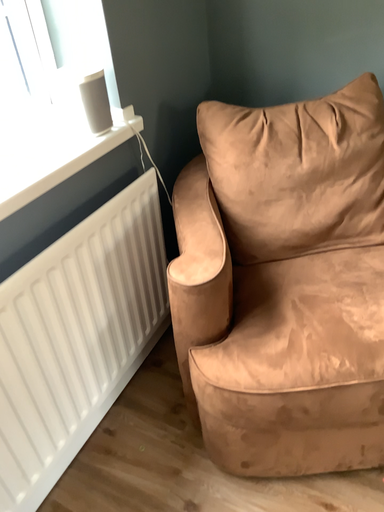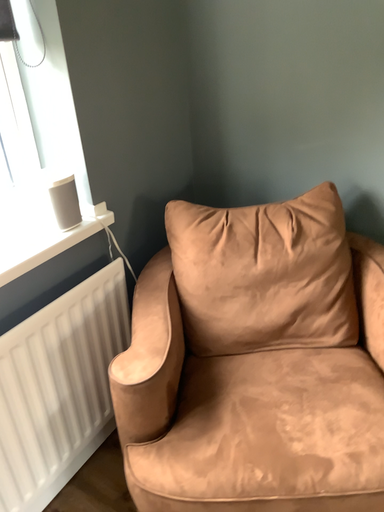
Question: How did the camera likely rotate when shooting the video?

Choices:
 (A) rotated upward
 (B) rotated downward

Answer: (A)